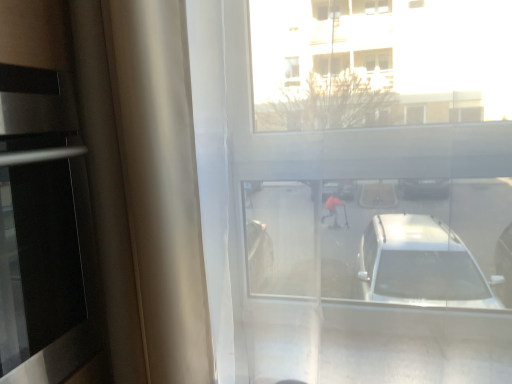
This screenshot has height=384, width=512. In order to click on beige fabric curtain at left in this screenshot , I will do `click(161, 184)`.

What do you see at coordinates (161, 184) in the screenshot? The image size is (512, 384). I see `beige fabric curtain at left` at bounding box center [161, 184].

Measure the distance between beige fabric curtain at left and camera.

They are 30.14 inches apart.

Locate an element on the screen. Image resolution: width=512 pixels, height=384 pixels. beige fabric curtain at left is located at coordinates (161, 184).